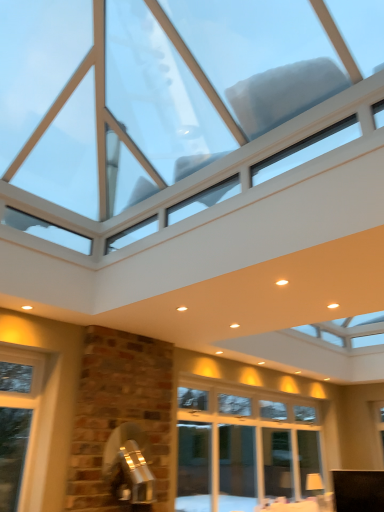
Question: Is black fabric cabinet at lower right surrounding transparent glass window at upper center?

Choices:
 (A) no
 (B) yes

Answer: (A)

Question: From a real-world perspective, is black fabric cabinet at lower right positioned over transparent glass window at upper center based on gravity?

Choices:
 (A) yes
 (B) no

Answer: (B)

Question: From a real-world perspective, is black fabric cabinet at lower right below transparent glass window at upper center?

Choices:
 (A) no
 (B) yes

Answer: (B)

Question: Can you confirm if black fabric cabinet at lower right is wider than transparent glass window at upper center?

Choices:
 (A) yes
 (B) no

Answer: (B)

Question: Does black fabric cabinet at lower right come behind transparent glass window at upper center?

Choices:
 (A) no
 (B) yes

Answer: (B)

Question: Can you confirm if black fabric cabinet at lower right is taller than transparent glass window at upper center?

Choices:
 (A) no
 (B) yes

Answer: (A)

Question: Is transparent glass window at upper center oriented away from black fabric cabinet at lower right?

Choices:
 (A) yes
 (B) no

Answer: (B)

Question: Is transparent glass window at upper center at the right side of black fabric cabinet at lower right?

Choices:
 (A) no
 (B) yes

Answer: (A)

Question: Is there a large distance between transparent glass window at upper center and black fabric cabinet at lower right?

Choices:
 (A) no
 (B) yes

Answer: (B)

Question: Is transparent glass window at upper center wider than black fabric cabinet at lower right?

Choices:
 (A) no
 (B) yes

Answer: (B)

Question: Does transparent glass window at upper center have a lesser width compared to black fabric cabinet at lower right?

Choices:
 (A) yes
 (B) no

Answer: (B)

Question: Considering the relative sizes of transparent glass window at upper center and black fabric cabinet at lower right in the image provided, is transparent glass window at upper center bigger than black fabric cabinet at lower right?

Choices:
 (A) yes
 (B) no

Answer: (A)

Question: Considering the positions of point (360, 501) and point (140, 9), is point (360, 501) closer or farther from the camera than point (140, 9)?

Choices:
 (A) farther
 (B) closer

Answer: (A)